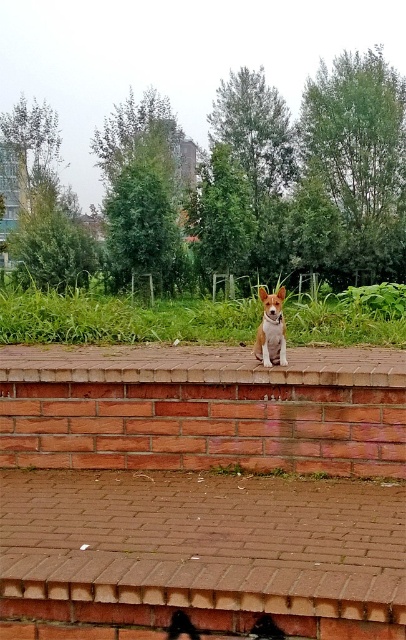
From the picture: You are standing at the camera position and want to throw a ball to the point at coordinates point (97, 352). If your throwing range is 20 feet, can you reach that point?

The distance between point (97, 352) and the camera is 18.27 feet, which is within your throwing range of 20 feet. Yes, you can reach that point.

You are standing in front of the brick wall where the small dog is sitting. There is a specific brick marked at point (202, 364). Can you tell me where this brick is located relative to the dog?

The brick at center is located at point (202, 364), which is directly under the dog since the dog is sitting on the brick wall at the center.

You are a dog trainer who wants to place a treat between the brick at center and the brown fur dog at center. Can you fit the treat in the space between them?

The brick at center and brown fur dog at center are 35.41 inches apart from each other, so yes, you can fit a treat in the space between them since the distance is sufficient.